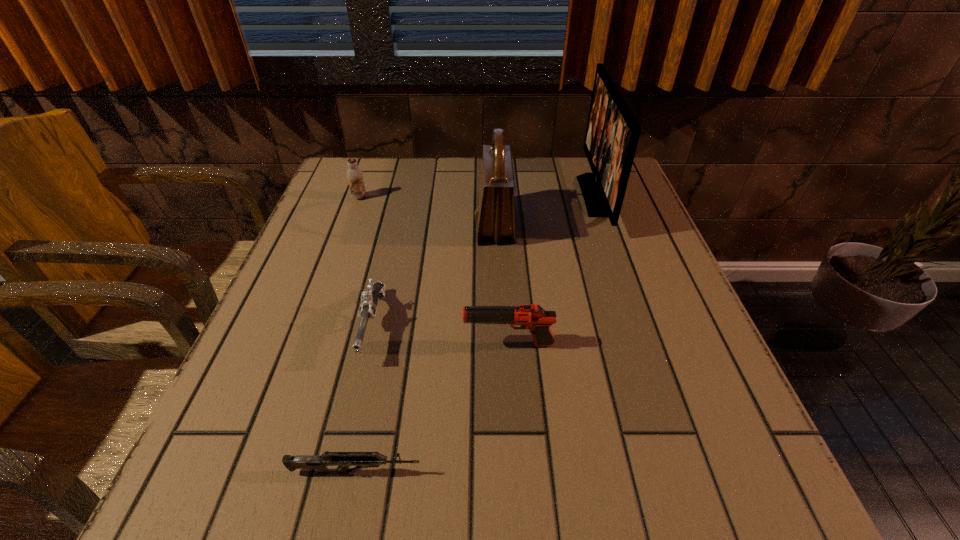
You are a GUI agent. You are given a task and a screenshot of the screen. Output one action in this format:
    pyautogui.click(x=<x>, y=<y>)
    Task: Click on the free point between the tallest gun and the fifth tallest object
    
    Given the screenshot: What is the action you would take?
    pyautogui.click(x=441, y=335)

Find the location of `vacant space in between the second shortest object and the monitor`. vacant space in between the second shortest object and the monitor is located at coordinates (484, 261).

Where is `vacant point located between the second tallest object and the tallest gun`? The image size is (960, 540). vacant point located between the second tallest object and the tallest gun is located at coordinates (502, 284).

The height and width of the screenshot is (540, 960). In order to click on free space between the shortest object and the second tallest object in this screenshot , I will do `click(425, 348)`.

Identify which object is the second closest to the shoulder bag. Please provide its 2D coordinates. Your answer should be formatted as a tuple, i.e. [(x, y)], where the tuple contains the x and y coordinates of a point satisfying the conditions above.

[(369, 299)]

Identify which object is located as the third nearest to the shoulder bag. Please provide its 2D coordinates. Your answer should be formatted as a tuple, i.e. [(x, y)], where the tuple contains the x and y coordinates of a point satisfying the conditions above.

[(533, 317)]

Choose which gun is the nearest neighbor to the nearest object. Please provide its 2D coordinates. Your answer should be formatted as a tuple, i.e. [(x, y)], where the tuple contains the x and y coordinates of a point satisfying the conditions above.

[(369, 299)]

Identify which gun is located as the nearest to the fifth shortest object. Please provide its 2D coordinates. Your answer should be formatted as a tuple, i.e. [(x, y)], where the tuple contains the x and y coordinates of a point satisfying the conditions above.

[(369, 299)]